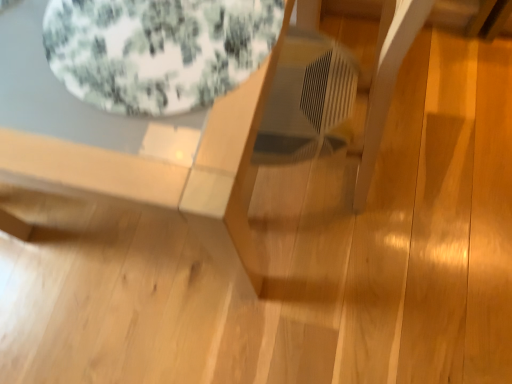
Measure the distance between point (111, 62) and camera.

They are 23.94 inches apart.

The image size is (512, 384). What are the coordinates of `floral fabric bean bag at upper left` in the screenshot? It's located at (157, 50).

This screenshot has width=512, height=384. What do you see at coordinates (157, 50) in the screenshot?
I see `floral fabric bean bag at upper left` at bounding box center [157, 50].

Where is `wooden table at center`? The width and height of the screenshot is (512, 384). wooden table at center is located at coordinates pyautogui.click(x=165, y=171).

The image size is (512, 384). What do you see at coordinates (165, 171) in the screenshot? I see `wooden table at center` at bounding box center [165, 171].

Identify the location of floral fabric bean bag at upper left. The width and height of the screenshot is (512, 384). (157, 50).

Considering the relative positions of wooden table at center and floral fabric bean bag at upper left in the image provided, is wooden table at center to the right of floral fabric bean bag at upper left from the viewer's perspective?

Incorrect, wooden table at center is not on the right side of floral fabric bean bag at upper left.

Is the position of wooden table at center more distant than that of floral fabric bean bag at upper left?

No, it is not.

Which is behind, point (241, 172) or point (190, 83)?

The point (241, 172) is farther.

From the image's perspective, does wooden table at center appear higher than floral fabric bean bag at upper left?

No, from the image's perspective, wooden table at center is not above floral fabric bean bag at upper left.

From a real-world perspective, is wooden table at center physically located above or below floral fabric bean bag at upper left?

From a real-world perspective, wooden table at center is physically below floral fabric bean bag at upper left.

Considering the sizes of objects wooden table at center and floral fabric bean bag at upper left in the image provided, who is thinner, wooden table at center or floral fabric bean bag at upper left?

floral fabric bean bag at upper left is thinner.

Looking at this image, does wooden table at center have a greater height compared to floral fabric bean bag at upper left?

Indeed, wooden table at center has a greater height compared to floral fabric bean bag at upper left.

Between wooden table at center and floral fabric bean bag at upper left, which one has larger size?

With larger size is wooden table at center.

Could floral fabric bean bag at upper left be considered to be inside wooden table at center?

Yes, floral fabric bean bag at upper left is a part of wooden table at center.

Is wooden table at center beside floral fabric bean bag at upper left?

No, wooden table at center is not touching floral fabric bean bag at upper left.

In the scene shown: Is wooden table at center facing towards floral fabric bean bag at upper left?

No, wooden table at center does not turn towards floral fabric bean bag at upper left.

Where is `bean bag chair that appears on the right of wooden table at center`? This screenshot has width=512, height=384. bean bag chair that appears on the right of wooden table at center is located at coordinates (157, 50).

Is floral fabric bean bag at upper left to the left of wooden table at center from the viewer's perspective?

No, floral fabric bean bag at upper left is not to the left of wooden table at center.

Between floral fabric bean bag at upper left and wooden table at center, which one is positioned behind?

floral fabric bean bag at upper left is more distant.

Is point (160, 22) positioned before point (11, 144)?

No.

From the image's perspective, which object appears higher, floral fabric bean bag at upper left or wooden table at center?

floral fabric bean bag at upper left appears higher in the image.

From a real-world perspective, who is located lower, floral fabric bean bag at upper left or wooden table at center?

wooden table at center.

Which of these two, floral fabric bean bag at upper left or wooden table at center, is thinner?

floral fabric bean bag at upper left.

Which of these two, floral fabric bean bag at upper left or wooden table at center, stands shorter?

floral fabric bean bag at upper left is shorter.

Is floral fabric bean bag at upper left bigger or smaller than wooden table at center?

Clearly, floral fabric bean bag at upper left is smaller in size than wooden table at center.

Based on the photo, does floral fabric bean bag at upper left contain wooden table at center?

That's incorrect, wooden table at center is not inside floral fabric bean bag at upper left.

Is floral fabric bean bag at upper left with wooden table at center?

No, floral fabric bean bag at upper left is not with wooden table at center.

Is floral fabric bean bag at upper left positioned with its back to wooden table at center?

Correct, floral fabric bean bag at upper left is looking away from wooden table at center.

How different are the orientations of floral fabric bean bag at upper left and wooden table at center in degrees?

They differ by 1.26 degrees in their facing directions.

This screenshot has width=512, height=384. In order to click on bean bag chair above the wooden table at center (from the image's perspective) in this screenshot , I will do `click(157, 50)`.

Identify the location of table on the left of floral fabric bean bag at upper left. The image size is (512, 384). (165, 171).

Where is `bean bag chair above the wooden table at center (from a real-world perspective)`? The width and height of the screenshot is (512, 384). bean bag chair above the wooden table at center (from a real-world perspective) is located at coordinates (157, 50).